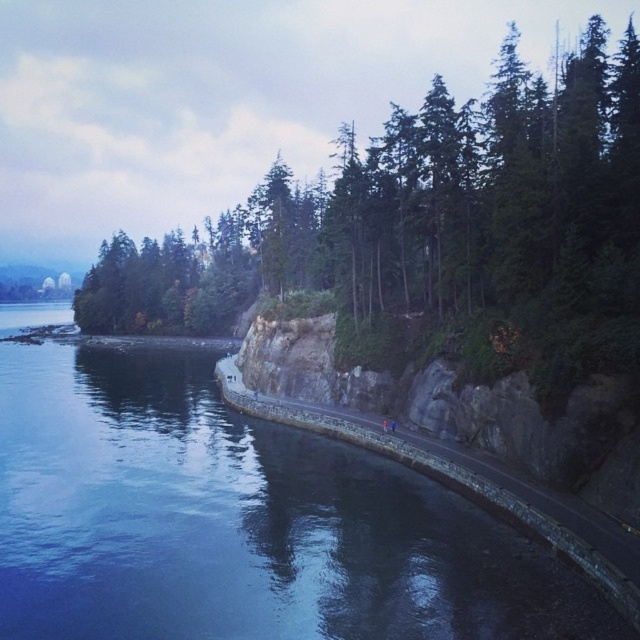
Does dark blue water at center have a greater height compared to green textured trees at center?

In fact, dark blue water at center may be shorter than green textured trees at center.

Is point (284, 580) positioned in front of point (179, 326)?

Yes.

You are a GUI agent. You are given a task and a screenshot of the screen. Output one action in this format:
    pyautogui.click(x=<x>, y=<y>)
    Task: Click on the dark blue water at center
    Image resolution: width=640 pixels, height=640 pixels.
    Given the screenshot: What is the action you would take?
    pyautogui.click(x=237, y=520)

What do you see at coordinates (438, 232) in the screenshot? I see `green textured trees at center` at bounding box center [438, 232].

Find the location of a particular element. This screenshot has width=640, height=640. green textured trees at center is located at coordinates (438, 232).

This screenshot has height=640, width=640. In order to click on green textured trees at center in this screenshot , I will do `click(438, 232)`.

Is dark blue water at center above dark gray asphalt road at center?

Correct, dark blue water at center is located above dark gray asphalt road at center.

Does point (70, 388) lie behind point (380, 435)?

That is True.

Does point (36, 417) come in front of point (417, 444)?

That is False.

This screenshot has height=640, width=640. Identify the location of dark blue water at center. (237, 520).